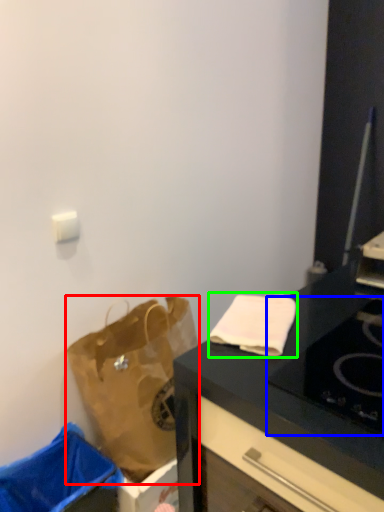
Question: Which is farther away from handbag (highlighted by a red box)? gas stove (highlighted by a blue box) or cloth (highlighted by a green box)?

Choices:
 (A) gas stove
 (B) cloth

Answer: (A)